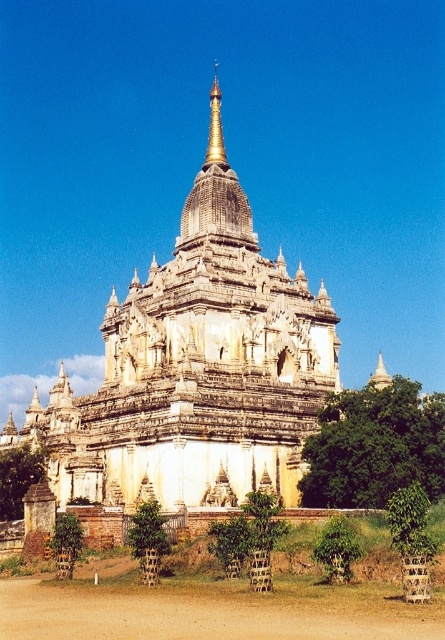
Question: Which object is closer to the camera taking this photo?

Choices:
 (A) brown sandy dirt at lower center
 (B) gold polished spire at center

Answer: (A)

Question: Can you confirm if brown sandy dirt at lower center is positioned to the right of gold polished spire at center?

Choices:
 (A) yes
 (B) no

Answer: (B)

Question: Is brown sandy dirt at lower center smaller than gold polished spire at center?

Choices:
 (A) yes
 (B) no

Answer: (A)

Question: Which of the following is the closest to the observer?

Choices:
 (A) (218, 128)
 (B) (77, 630)

Answer: (B)

Question: Which of the following is the closest to the observer?

Choices:
 (A) brown sandy dirt at lower center
 (B) gold polished spire at center

Answer: (A)

Question: Can you confirm if brown sandy dirt at lower center is thinner than gold polished spire at center?

Choices:
 (A) no
 (B) yes

Answer: (A)